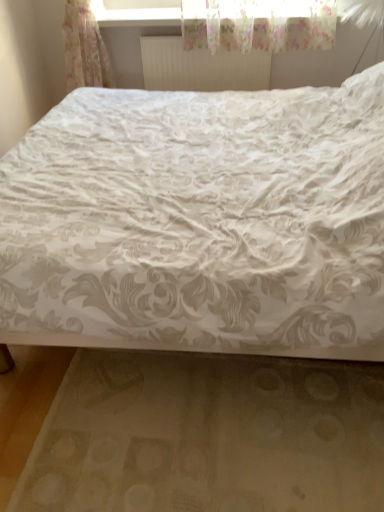
Question: From a real-world perspective, is white matte radiator at upper center positioned under white floral fabric bed at center based on gravity?

Choices:
 (A) yes
 (B) no

Answer: (B)

Question: From the image's perspective, is white matte radiator at upper center beneath white floral fabric bed at center?

Choices:
 (A) yes
 (B) no

Answer: (B)

Question: Does white matte radiator at upper center turn towards white floral fabric bed at center?

Choices:
 (A) no
 (B) yes

Answer: (B)

Question: Considering the relative sizes of white matte radiator at upper center and white floral fabric bed at center in the image provided, is white matte radiator at upper center thinner than white floral fabric bed at center?

Choices:
 (A) yes
 (B) no

Answer: (A)

Question: Can you confirm if white matte radiator at upper center is shorter than white floral fabric bed at center?

Choices:
 (A) yes
 (B) no

Answer: (A)

Question: Considering the relative sizes of white matte radiator at upper center and white floral fabric bed at center in the image provided, is white matte radiator at upper center smaller than white floral fabric bed at center?

Choices:
 (A) yes
 (B) no

Answer: (A)

Question: Is white floral fabric bed at center wider than white fabric bed frame at lower center?

Choices:
 (A) yes
 (B) no

Answer: (A)

Question: Is white fabric bed frame at lower center inside white floral fabric bed at center?

Choices:
 (A) yes
 (B) no

Answer: (A)

Question: Does white floral fabric bed at center come in front of white fabric bed frame at lower center?

Choices:
 (A) yes
 (B) no

Answer: (A)

Question: Does white floral fabric bed at center have a lesser width compared to white fabric bed frame at lower center?

Choices:
 (A) no
 (B) yes

Answer: (A)

Question: Can you confirm if white floral fabric bed at center is bigger than white fabric bed frame at lower center?

Choices:
 (A) no
 (B) yes

Answer: (B)

Question: From the image's perspective, would you say white floral fabric bed at center is shown under white fabric bed frame at lower center?

Choices:
 (A) no
 (B) yes

Answer: (A)

Question: Can you confirm if white fabric bed frame at lower center is positioned to the left of white floral fabric bed at center?

Choices:
 (A) no
 (B) yes

Answer: (B)